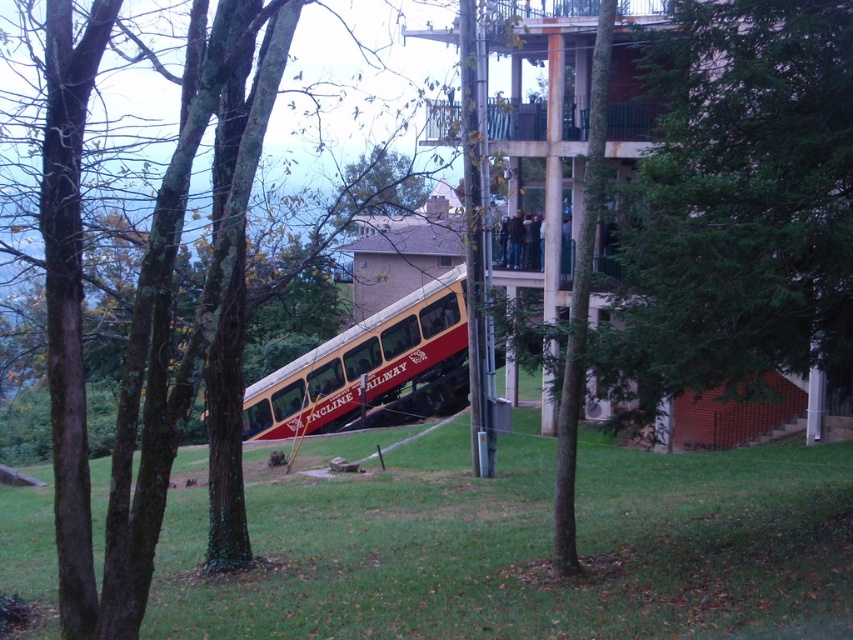
Who is lower down, green bark tree at center or red polished wood passenger train at center?

red polished wood passenger train at center

Between point (132, 428) and point (339, 422), which one is positioned in front?

Point (132, 428)

Identify the location of green bark tree at center. Image resolution: width=853 pixels, height=640 pixels. (138, 296).